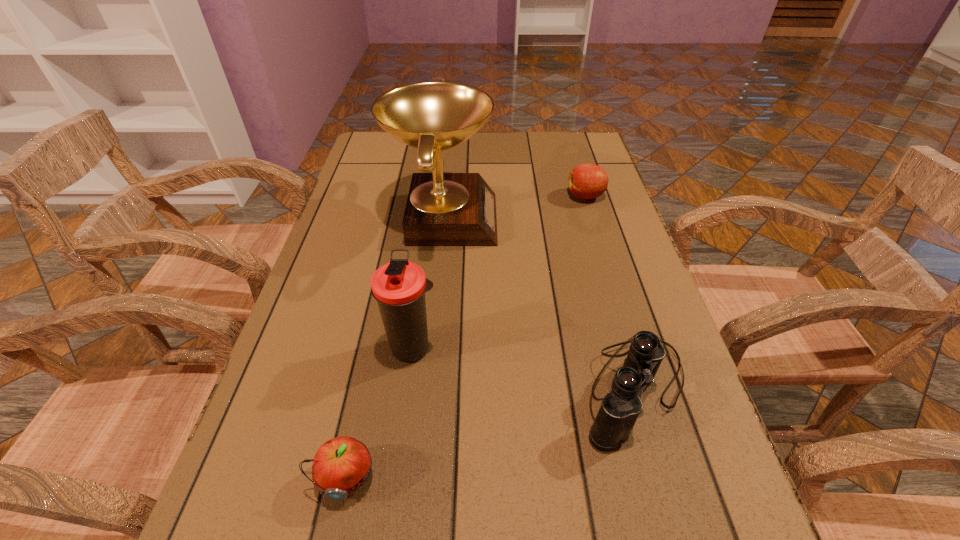
This screenshot has width=960, height=540. Identify the location of free space in the image that satisfies the following two spatial constraints: 1. on the front-facing side of the tallest object; 2. on the right side of the third shortest object. (426, 387).

Locate an element on the screen. This screenshot has width=960, height=540. vacant area that satisfies the following two spatial constraints: 1. on the back side of the second tallest object; 2. on the left side of the right apple is located at coordinates point(434,196).

Find the location of `blank area in the image that satisfies the following two spatial constraints: 1. on the back side of the third tallest object; 2. on the left side of the nearer apple`. blank area in the image that satisfies the following two spatial constraints: 1. on the back side of the third tallest object; 2. on the left side of the nearer apple is located at coordinates (365, 387).

The height and width of the screenshot is (540, 960). I want to click on vacant region that satisfies the following two spatial constraints: 1. on the front side of the thermos bottle; 2. on the right side of the third shortest object, so click(408, 387).

At what (x,y) coordinates should I click in order to perform the action: click on free space in the image that satisfies the following two spatial constraints: 1. on the back side of the nearer apple; 2. on the left side of the third shortest object. Please return your answer as a coordinate pair (x, y). The width and height of the screenshot is (960, 540). Looking at the image, I should click on (365, 387).

This screenshot has height=540, width=960. What are the coordinates of `vacant region that satisfies the following two spatial constraints: 1. on the front side of the farther apple; 2. on the front-facing side of the tallest object` in the screenshot? It's located at (591, 217).

The image size is (960, 540). Find the location of `free space that satisfies the following two spatial constraints: 1. on the back side of the third tallest object; 2. on the left side of the left apple`. free space that satisfies the following two spatial constraints: 1. on the back side of the third tallest object; 2. on the left side of the left apple is located at coordinates (365, 387).

Where is `vacant space that satisfies the following two spatial constraints: 1. on the back side of the third shortest object; 2. on the front-facing side of the tallest object`? The height and width of the screenshot is (540, 960). vacant space that satisfies the following two spatial constraints: 1. on the back side of the third shortest object; 2. on the front-facing side of the tallest object is located at coordinates (585, 217).

Where is `vacant space that satisfies the following two spatial constraints: 1. on the back side of the binoculars; 2. on the front-facing side of the tallest object`? vacant space that satisfies the following two spatial constraints: 1. on the back side of the binoculars; 2. on the front-facing side of the tallest object is located at coordinates (585, 217).

Locate an element on the screen. The width and height of the screenshot is (960, 540). vacant space that satisfies the following two spatial constraints: 1. on the back side of the fourth shortest object; 2. on the right side of the right apple is located at coordinates click(x=434, y=196).